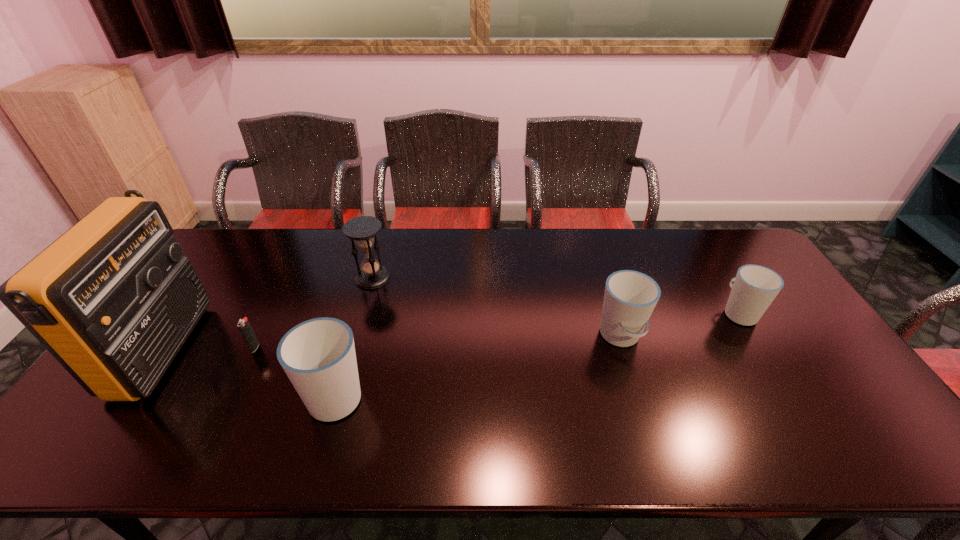
Image resolution: width=960 pixels, height=540 pixels. I want to click on free spot between the nearest cup and the second object from right to left, so click(x=478, y=366).

The width and height of the screenshot is (960, 540). I want to click on free point between the shortest cup and the fifth object from left to right, so click(x=680, y=325).

This screenshot has height=540, width=960. Identify the location of free spot between the second tallest cup and the nearest cup. (478, 366).

You are a GUI agent. You are given a task and a screenshot of the screen. Output one action in this format:
    pyautogui.click(x=<x>, y=<y>)
    Task: Click on the vacant space in between the igniter and the rightmost cup
    The width and height of the screenshot is (960, 540).
    Given the screenshot: What is the action you would take?
    pyautogui.click(x=497, y=330)

Where is `free spot between the second shortest object and the farthest object`? The height and width of the screenshot is (540, 960). free spot between the second shortest object and the farthest object is located at coordinates [556, 295].

I want to click on vacant point located between the second shortest cup and the rightmost object, so click(680, 325).

The width and height of the screenshot is (960, 540). What are the coordinates of `unoccupied position between the second tallest cup and the farthest object` in the screenshot? It's located at (496, 307).

This screenshot has height=540, width=960. In order to click on free space between the farthest object and the shortest object in this screenshot , I will do `click(314, 313)`.

You are a GUI agent. You are given a task and a screenshot of the screen. Output one action in this format:
    pyautogui.click(x=<x>, y=<y>)
    Task: Click on the free space that is in between the radio receiver and the leftmost cup
    
    Given the screenshot: What is the action you would take?
    pyautogui.click(x=250, y=372)

Identify the location of free point between the second shortest object and the farthest object. (556, 295).